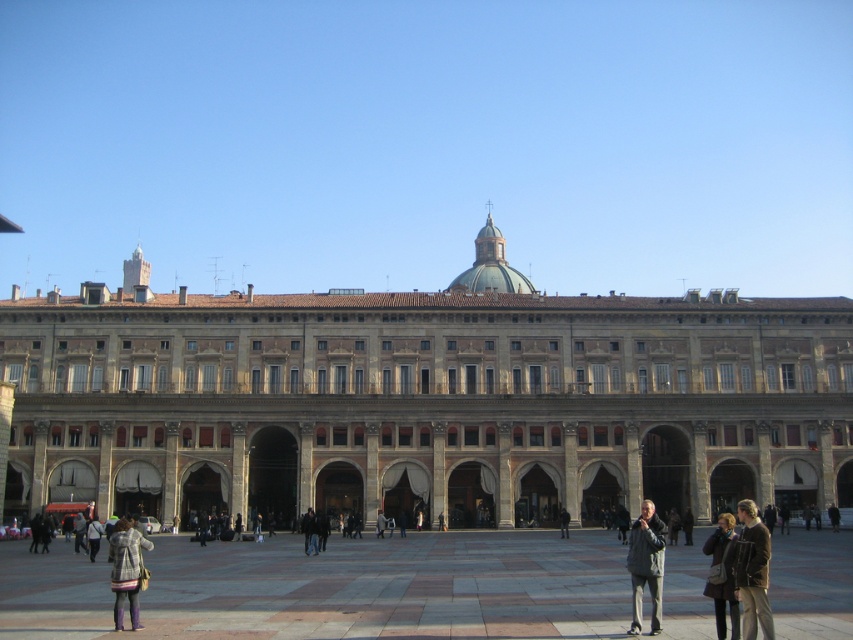
Between point (233, 316) and point (132, 573), which one is positioned in front?

Positioned in front is point (132, 573).

Which is behind, point (412, 365) or point (120, 536)?

The point (412, 365) is more distant.

Is point (746, 337) farther from camera compared to point (132, 612)?

Yes, point (746, 337) is behind point (132, 612).

Locate an element on the screen. Image resolution: width=853 pixels, height=640 pixels. brown stone building at center is located at coordinates (425, 400).

Which is below, gray fabric jacket at lower right or dark gray jacket at center?

dark gray jacket at center is lower down.

Which is more to the left, gray fabric jacket at lower right or dark gray jacket at center?

From the viewer's perspective, dark gray jacket at center appears more on the left side.

Measure the distance between point (656, 529) and camera.

A distance of 149.84 feet exists between point (656, 529) and camera.

Locate an element on the screen. The width and height of the screenshot is (853, 640). gray fabric jacket at lower right is located at coordinates (646, 564).

Is smooth stone courtyard at center taller than dark gray wool coat at lower right?

In fact, smooth stone courtyard at center may be shorter than dark gray wool coat at lower right.

Is point (51, 563) positioned before point (722, 520)?

No, it is behind (722, 520).

Who is more distant from viewer, (323, 627) or (723, 600)?

The point (323, 627) is behind.

Identify the location of smooth stone courtyard at center. The width and height of the screenshot is (853, 640). (x=392, y=586).